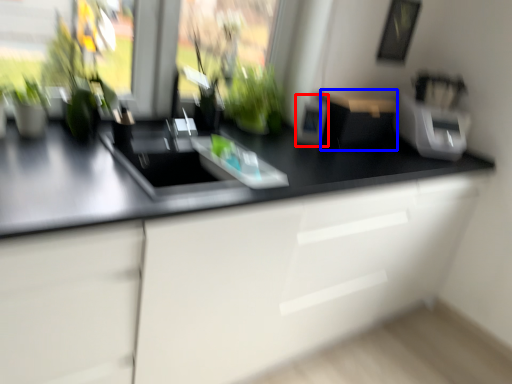
Question: Which object is further to the camera taking this photo, appliance (highlighted by a red box) or appliance (highlighted by a blue box)?

Choices:
 (A) appliance
 (B) appliance

Answer: (A)